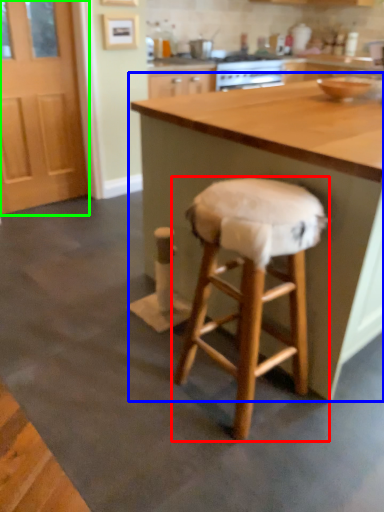
Question: Based on their relative distances, which object is farther from stool (highlighted by a red box)? Choose from table (highlighted by a blue box) and screen door (highlighted by a green box).

Choices:
 (A) table
 (B) screen door

Answer: (B)